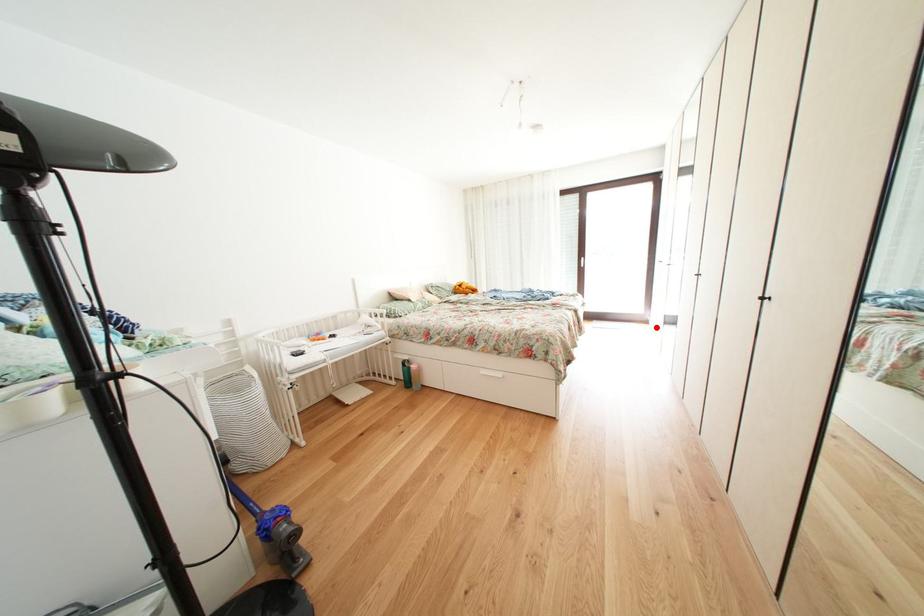
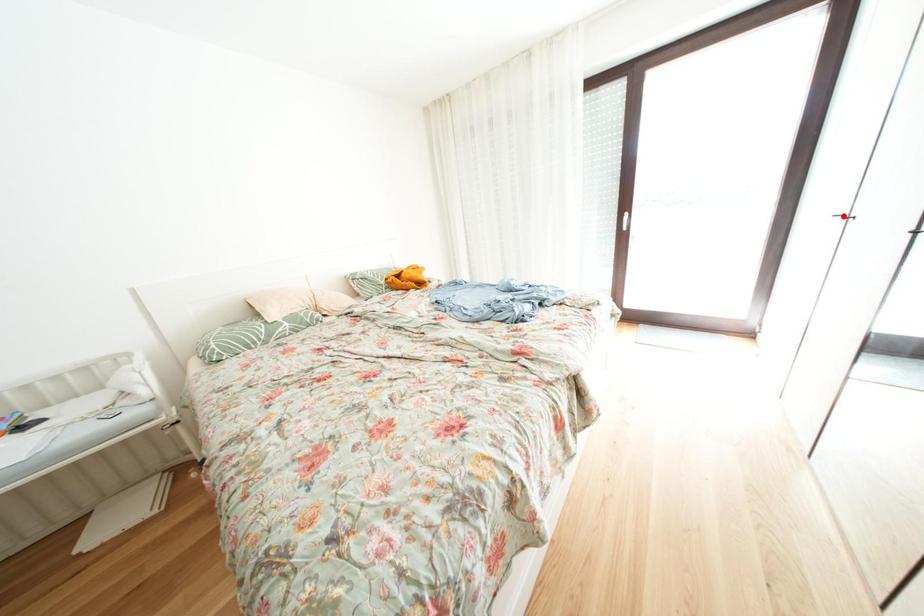
I am providing you with two images of the same scene from different viewpoints. A red point is marked on the first image and another point is marked on the second image. Are the points marked in image1 and image2 representing the same 3D position?

No